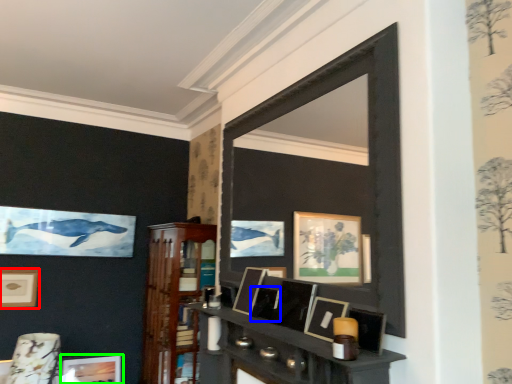
Question: Considering the real-world distances, which object is closest to picture frame (highlighted by a red box)? picture frame (highlighted by a blue box) or picture frame (highlighted by a green box).

Choices:
 (A) picture frame
 (B) picture frame

Answer: (B)